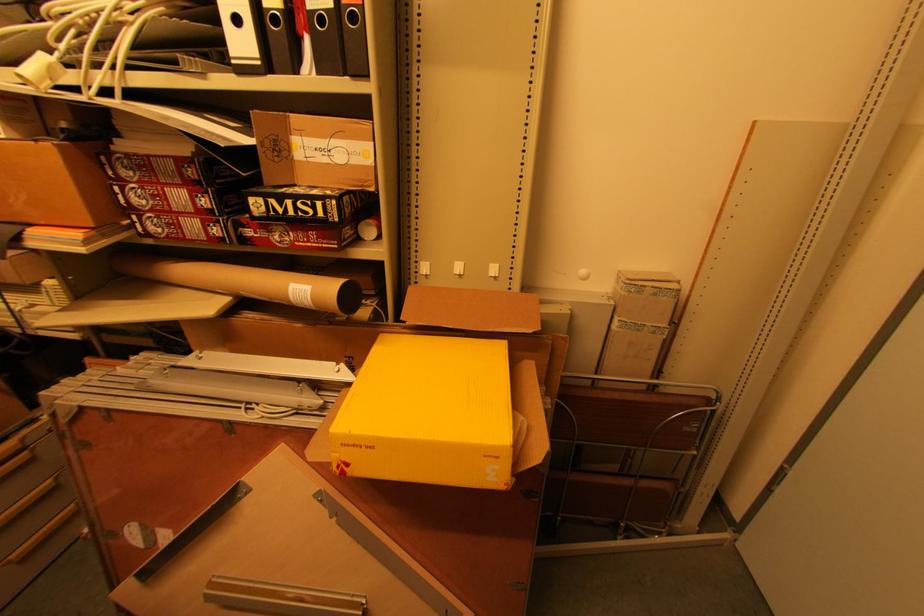
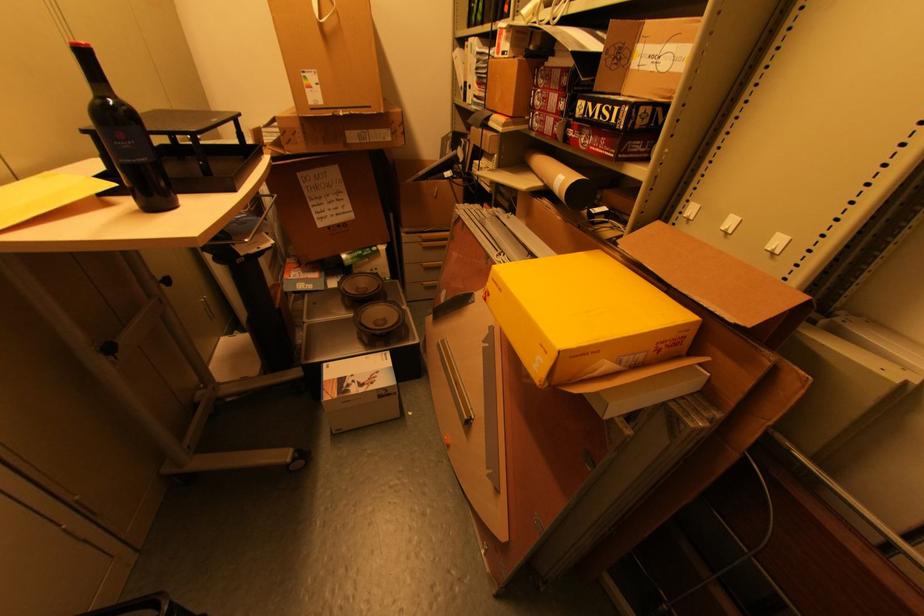
Where in the second image is the point corresponding to pixel 307 243 from the first image?

(599, 148)